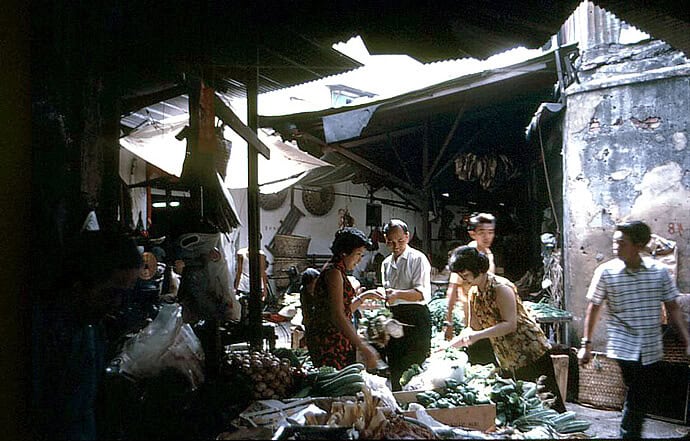
Identify the location of wooden box in foreground. The width and height of the screenshot is (690, 441). (483, 418).